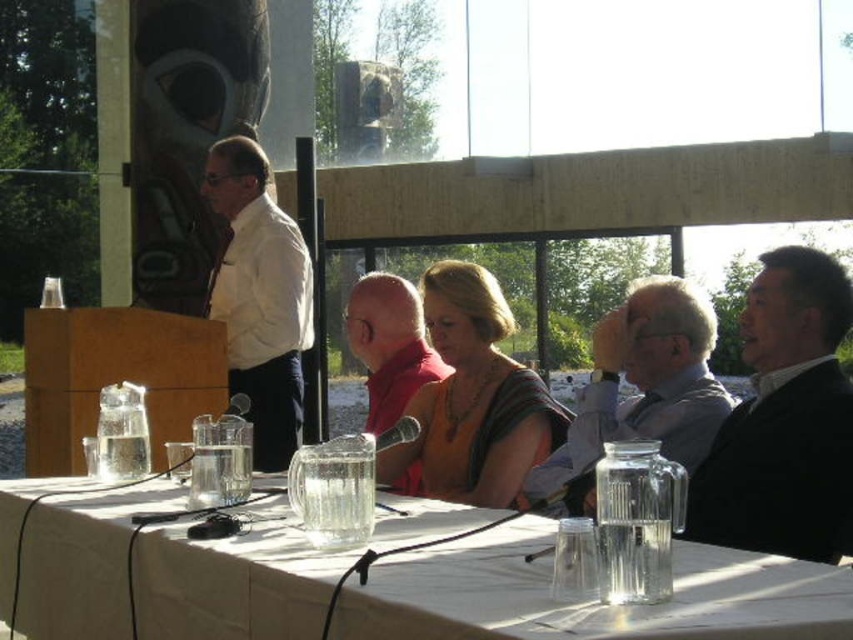
You are standing at the entrance of the pavilion and want to approach the clear glass table at center. According to the coordinates provided, in which direction should you move from your current position to reach the table?

The clear glass table at center is located at coordinates point (589,605), which means you should move forward and to the right from your current position at the entrance to reach it.

You are organizing a small event and need to decide seating arrangements. You have a clear glass table at center and a matte white shirt at left. Which object is bigger?

The clear glass table at center is larger in size compared to the matte white shirt at left.

You are a photographer at the event and need to capture a photo of the matte white shirt at left and the red fabric scarf at center. Which object should be placed closer to the camera to ensure both are in focus?

To ensure both the matte white shirt at left and the red fabric scarf at center are in focus, the matte white shirt at left should be closer to the camera since the red fabric scarf at center is behind it, creating a greater depth of field when focusing on the foreground object.